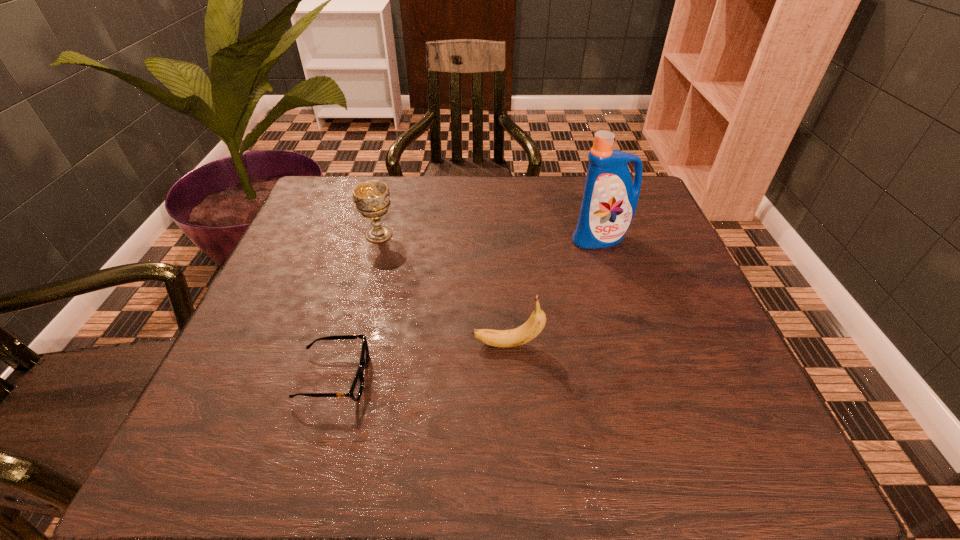
Where is `free point that satisfies the following two spatial constraints: 1. on the label of the rightmost object; 2. at the start of the peel on the banana`? free point that satisfies the following two spatial constraints: 1. on the label of the rightmost object; 2. at the start of the peel on the banana is located at coordinates (635, 345).

Identify the location of vacant space that satisfies the following two spatial constraints: 1. on the label of the rightmost object; 2. at the start of the peel on the banana. The image size is (960, 540). (635, 345).

You are a GUI agent. You are given a task and a screenshot of the screen. Output one action in this format:
    pyautogui.click(x=<x>, y=<y>)
    Task: Click on the vacant space that satisfies the following two spatial constraints: 1. on the label of the detergent; 2. at the start of the peel on the third object from left to right
    This screenshot has height=540, width=960.
    Given the screenshot: What is the action you would take?
    pyautogui.click(x=635, y=345)

The width and height of the screenshot is (960, 540). Find the location of `free spot that satisfies the following two spatial constraints: 1. on the label of the tallest object; 2. on the front-facing side of the shortest object`. free spot that satisfies the following two spatial constraints: 1. on the label of the tallest object; 2. on the front-facing side of the shortest object is located at coordinates (645, 377).